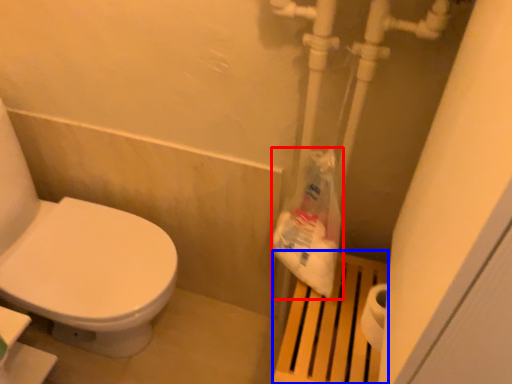
Question: Which object is closer to the camera taking this photo, paper bag (highlighted by a red box) or step stool (highlighted by a blue box)?

Choices:
 (A) paper bag
 (B) step stool

Answer: (A)